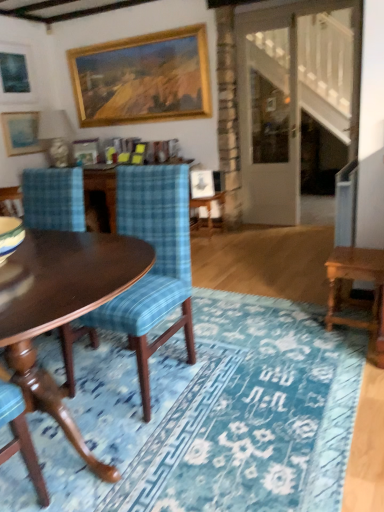
Question: From the image's perspective, relative to wooden table at right, is blue plaid fabric chair at left above or below?

Choices:
 (A) above
 (B) below

Answer: (A)

Question: Considering the positions of blue plaid fabric chair at left and wooden table at right in the image, is blue plaid fabric chair at left taller or shorter than wooden table at right?

Choices:
 (A) short
 (B) tall

Answer: (B)

Question: Based on their relative distances, which object is nearer to the wooden picture frame at upper center, which is the 2th picture frame in right-to-left order?

Choices:
 (A) matte blue picture frame at upper left, the second picture frame positioned from the left
 (B) gold-framed painting at upper center, which ranks as the 1th picture frame in right-to-left order
 (C) mahogany wood coffee table at lower left
 (D) wooden side table at center
 (E) white glossy lampshade at upper left

Answer: (E)

Question: Which object is positioned closest to the blue textured rug at center?

Choices:
 (A) matte black picture frame at upper left, which appears as the fourth picture frame when viewed from the right
 (B) matte blue picture frame at upper left, the second picture frame positioned from the left
 (C) blue plaid fabric chair at left
 (D) gold-framed painting at upper center, the 4th picture frame viewed from the left
 (E) mahogany wood coffee table at lower left

Answer: (C)